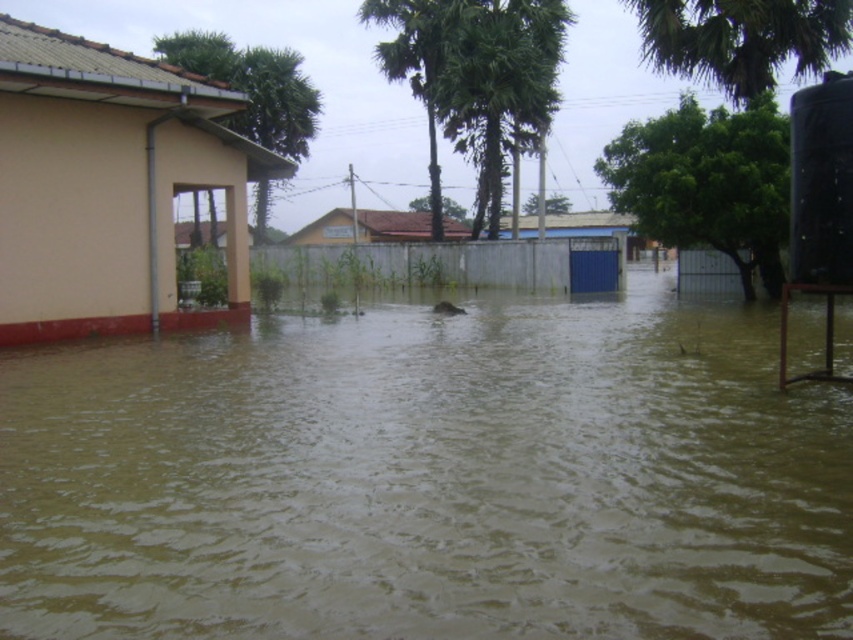
Question: Can you confirm if brown murky water at center is positioned to the left of green leafy palm tree at upper center?

Choices:
 (A) no
 (B) yes

Answer: (A)

Question: Is green leafy palm tree at upper center positioned before black matte water tank at right?

Choices:
 (A) yes
 (B) no

Answer: (B)

Question: Which point is closer to the camera?

Choices:
 (A) black matte water tank at right
 (B) green leafy palm tree at upper left

Answer: (A)

Question: Does brown murky water at center appear over green leafy palm tree at upper left?

Choices:
 (A) yes
 (B) no

Answer: (B)

Question: Which object is positioned closest to the brown murky water at center?

Choices:
 (A) green leafy palm tree at upper center
 (B) black matte water tank at right

Answer: (B)

Question: Which point appears farthest from the camera in this image?

Choices:
 (A) (816, 140)
 (B) (253, 435)
 (C) (476, 88)
 (D) (283, 106)

Answer: (D)